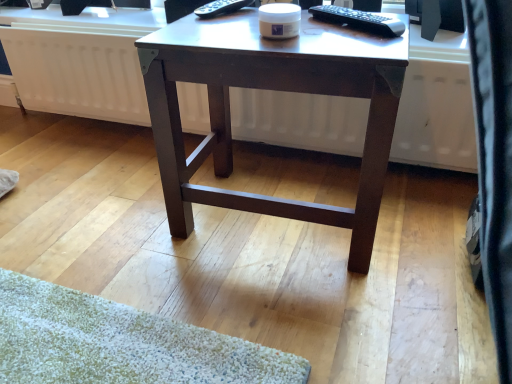
Find the location of `vacant area that is in front of black plastic remote control at upper center, the 2th remote control from the right`. vacant area that is in front of black plastic remote control at upper center, the 2th remote control from the right is located at coordinates (228, 28).